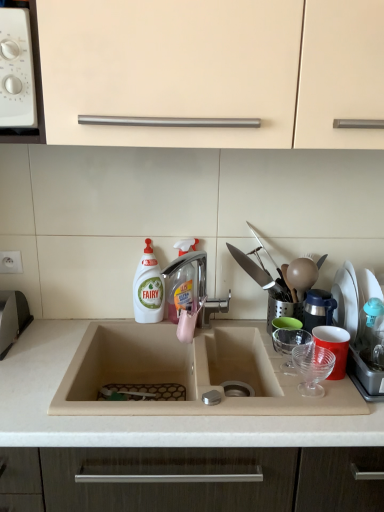
This screenshot has width=384, height=512. What are the coordinates of `beige matte cabinet at upper center` in the screenshot? It's located at tap(215, 70).

What are the coordinates of `white plastic knobs at upper left` in the screenshot? It's located at (16, 70).

What do you see at coordinates (148, 288) in the screenshot? I see `white plastic bottle at center` at bounding box center [148, 288].

What do you see at coordinates (191, 263) in the screenshot? I see `silver metallic tap at center` at bounding box center [191, 263].

I want to click on red plastic cup at right, so click(x=357, y=324).

This screenshot has height=512, width=384. Describe the element at coordinates (357, 324) in the screenshot. I see `red plastic cup at right` at that location.

I want to click on beige laminate countertop at center, so click(x=143, y=416).

Describe the element at coordinates (143, 416) in the screenshot. This screenshot has width=384, height=512. I see `beige laminate countertop at center` at that location.

At what (x,y) coordinates should I click in order to perform the action: click on beige matte cabinet at upper center. Please return your answer as a coordinate pair (x, y). Looking at the image, I should click on (215, 70).

Could beige laminate countertop at center be considered to be inside white plastic bottle at center?

Actually, beige laminate countertop at center is outside white plastic bottle at center.

Does white plastic bottle at center appear on the right side of beige laminate countertop at center?

Incorrect, white plastic bottle at center is not on the right side of beige laminate countertop at center.

Which is behind, white plastic bottle at center or beige laminate countertop at center?

white plastic bottle at center.

Considering the relative sizes of white plastic bottle at center and transparent plastic spray bottle at center in the image provided, is white plastic bottle at center wider than transparent plastic spray bottle at center?

Correct, the width of white plastic bottle at center exceeds that of transparent plastic spray bottle at center.

Which object is positioned more to the left, white plastic bottle at center or transparent plastic spray bottle at center?

From the viewer's perspective, white plastic bottle at center appears more on the left side.

Find the location of a particular element. bottle on the right of white plastic bottle at center is located at coordinates (181, 281).

Is white plastic bottle at center in front of or behind transparent plastic spray bottle at center in the image?

white plastic bottle at center is behind transparent plastic spray bottle at center.

From the image's perspective, is beige laminate countertop at center on top of white plastic knobs at upper left?

No, from the image's perspective, beige laminate countertop at center is not above white plastic knobs at upper left.

Between beige laminate countertop at center and white plastic knobs at upper left, which one has larger size?

With larger size is beige laminate countertop at center.

Based on the photo, is beige laminate countertop at center not near white plastic knobs at upper left?

No, beige laminate countertop at center is not far away from white plastic knobs at upper left.

In the scene shown: Is beige laminate countertop at center looking in the opposite direction of white plastic knobs at upper left?

No, white plastic knobs at upper left is not at the back of beige laminate countertop at center.

Considering their positions, is silver metallic tap at center located in front of or behind beige laminate countertop at center?

silver metallic tap at center is positioned farther from the viewer than beige laminate countertop at center.

Is silver metallic tap at center positioned beyond the bounds of beige laminate countertop at center?

Yes.

Based on the photo, from a real-world perspective, does silver metallic tap at center stand above beige laminate countertop at center?

Correct, in the physical world, silver metallic tap at center is higher than beige laminate countertop at center.

How many degrees apart are the facing directions of silver metallic tap at center and beige laminate countertop at center?

The facing directions of silver metallic tap at center and beige laminate countertop at center are 7.35 degrees apart.

Is white plastic bottle at center with red plastic cup at right?

There is a gap between white plastic bottle at center and red plastic cup at right.

From a real-world perspective, which object stands above the other?

white plastic bottle at center, from a real-world perspective.

From the image's perspective, which object appears higher, white plastic bottle at center or red plastic cup at right?

white plastic bottle at center.

Is white plastic bottle at center behind red plastic cup at right?

Yes, white plastic bottle at center is further from the camera.

Based on the photo, is beige matte cabinet at upper center at the back of white plastic knobs at upper left?

Yes.

Considering the relative positions of white plastic knobs at upper left and beige matte cabinet at upper center in the image provided, is white plastic knobs at upper left to the left of beige matte cabinet at upper center from the viewer's perspective?

Yes, white plastic knobs at upper left is to the left of beige matte cabinet at upper center.

Does white plastic knobs at upper left have a larger size compared to beige matte cabinet at upper center?

Incorrect, white plastic knobs at upper left is not larger than beige matte cabinet at upper center.

Is the surface of white plastic knobs at upper left in direct contact with beige matte cabinet at upper center?

No, white plastic knobs at upper left is not making contact with beige matte cabinet at upper center.

Which is correct: beige matte cabinet at upper center is inside silver metallic tap at center, or outside of it?

beige matte cabinet at upper center exists outside the volume of silver metallic tap at center.

Considering their positions, is beige matte cabinet at upper center located in front of or behind silver metallic tap at center?

beige matte cabinet at upper center is positioned closer to the viewer than silver metallic tap at center.

Is beige matte cabinet at upper center shorter than silver metallic tap at center?

No.

Where is `cleaning product above the beige laminate countertop at center (from the image's perspective)`? Image resolution: width=384 pixels, height=512 pixels. cleaning product above the beige laminate countertop at center (from the image's perspective) is located at coordinates (148, 288).

You are a GUI agent. You are given a task and a screenshot of the screen. Output one action in this format:
    pyautogui.click(x=<x>, y=<y>)
    Task: Click on the cleaning product that appears below the transparent plastic spray bottle at center (from a real-world perspective)
    The width and height of the screenshot is (384, 512).
    Given the screenshot: What is the action you would take?
    pyautogui.click(x=148, y=288)

Which object lies further to the anchor point red plastic cup at right, white plastic bottle at center or white plastic knobs at upper left?

white plastic knobs at upper left is positioned further to the anchor red plastic cup at right.

Considering their positions, is red plastic cup at right positioned further to transparent plastic spray bottle at center than beige laminate countertop at center?

red plastic cup at right lies further to transparent plastic spray bottle at center than the other object.

Looking at the image, which one is located further to white plastic knobs at upper left, beige matte cabinet at upper center or transparent plastic spray bottle at center?

Based on the image, transparent plastic spray bottle at center appears to be further to white plastic knobs at upper left.

Looking at the image, which one is located further to red plastic cup at right, white plastic knobs at upper left or silver metallic tap at center?

Based on the image, white plastic knobs at upper left appears to be further to red plastic cup at right.

Based on their spatial positions, is red plastic cup at right or white plastic bottle at center further from beige laminate countertop at center?

white plastic bottle at center lies further to beige laminate countertop at center than the other object.

Based on their spatial positions, is transparent plastic spray bottle at center or beige laminate countertop at center further from white plastic knobs at upper left?

beige laminate countertop at center lies further to white plastic knobs at upper left than the other object.

Which object lies nearer to the anchor point transparent plastic spray bottle at center, red plastic cup at right or white plastic bottle at center?

Based on the image, white plastic bottle at center appears to be nearer to transparent plastic spray bottle at center.

Estimate the real-world distances between objects in this image. Which object is closer to red plastic cup at right, silver metallic tap at center or transparent plastic spray bottle at center?

silver metallic tap at center is positioned closer to the anchor red plastic cup at right.

Find the location of a particular element. cabinetry located between white plastic knobs at upper left and red plastic cup at right in the left-right direction is located at coordinates (215, 70).

Find the location of a particular element. tap situated between white plastic bottle at center and red plastic cup at right from left to right is located at coordinates [x=191, y=263].

Where is `cleaning product that lies between beige matte cabinet at upper center and transparent plastic spray bottle at center from top to bottom`? The width and height of the screenshot is (384, 512). cleaning product that lies between beige matte cabinet at upper center and transparent plastic spray bottle at center from top to bottom is located at coordinates (148, 288).

Find the location of a particular element. The width and height of the screenshot is (384, 512). bottle between white plastic bottle at center and beige laminate countertop at center from top to bottom is located at coordinates (181, 281).